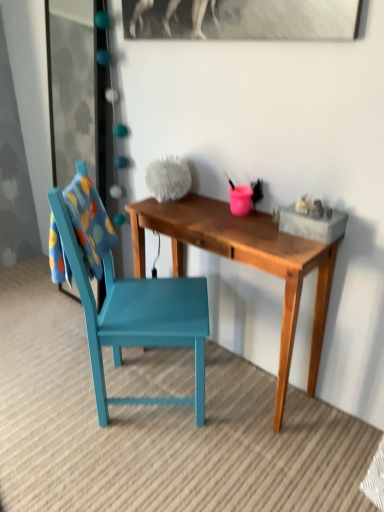
The width and height of the screenshot is (384, 512). What are the coordinates of `wooden desk at center` in the screenshot? It's located at (245, 263).

How far apart are transparent glass door at upper left and teal painted wood chair at left?

transparent glass door at upper left is 1.54 meters away from teal painted wood chair at left.

Based on the photo, can we say transparent glass door at upper left lies outside teal painted wood chair at left?

Yes, transparent glass door at upper left is not within teal painted wood chair at left.

From the image's perspective, between transparent glass door at upper left and teal painted wood chair at left, which one is located above?

transparent glass door at upper left.

Does transparent glass door at upper left have a larger size compared to teal painted wood chair at left?

Actually, transparent glass door at upper left might be smaller than teal painted wood chair at left.

From a real-world perspective, relative to wooden desk at center, is teal painted wood chair at left vertically above or below?

In terms of real-world spatial position, teal painted wood chair at left is above wooden desk at center.

From the image's perspective, does teal painted wood chair at left appear higher than wooden desk at center?

Yes.

Considering the points (104, 405) and (131, 217), which point is behind, point (104, 405) or point (131, 217)?

The point (131, 217) is farther from the camera.

Is teal painted wood chair at left not close to wooden desk at center?

No, there isn't a large distance between teal painted wood chair at left and wooden desk at center.

From a real-world perspective, between transparent glass door at upper left and wooden desk at center, who is vertically lower?

From a 3D spatial view, wooden desk at center is below.

Does transparent glass door at upper left touch wooden desk at center?

No, transparent glass door at upper left is not in contact with wooden desk at center.

Is transparent glass door at upper left situated inside wooden desk at center or outside?

transparent glass door at upper left is not enclosed by wooden desk at center.

Is transparent glass door at upper left positioned behind wooden desk at center?

Yes, transparent glass door at upper left is behind wooden desk at center.

Is point (170, 399) behind point (49, 103)?

That is False.

Looking at this image, from a real-world perspective, is teal painted wood chair at left under transparent glass door at upper left?

Yes, from a real-world perspective, teal painted wood chair at left is beneath transparent glass door at upper left.

Looking at this image, how many degrees apart are the facing directions of teal painted wood chair at left and transparent glass door at upper left?

The angular difference between teal painted wood chair at left and transparent glass door at upper left is 129 degrees.

From the image's perspective, who appears lower, teal painted wood chair at left or transparent glass door at upper left?

teal painted wood chair at left, from the image's perspective.

Looking at their sizes, would you say wooden desk at center is wider or thinner than transparent glass door at upper left?

In the image, wooden desk at center appears to be wider than transparent glass door at upper left.

How much distance is there between wooden desk at center and transparent glass door at upper left?

wooden desk at center and transparent glass door at upper left are 1.57 meters apart from each other.

Could you tell me if wooden desk at center is turned towards transparent glass door at upper left?

No, wooden desk at center does not turn towards transparent glass door at upper left.

Can you tell me how much wooden desk at center and transparent glass door at upper left differ in facing direction?

0.658 degrees separate the facing orientations of wooden desk at center and transparent glass door at upper left.

Looking at this image, is wooden desk at center thinner than teal painted wood chair at left?

Indeed, wooden desk at center has a lesser width compared to teal painted wood chair at left.

Is wooden desk at center next to teal painted wood chair at left and touching it?

No, wooden desk at center is not touching teal painted wood chair at left.

Considering the sizes of objects wooden desk at center and teal painted wood chair at left in the image provided, who is shorter, wooden desk at center or teal painted wood chair at left?

Standing shorter between the two is wooden desk at center.

How many degrees apart are the facing directions of wooden desk at center and teal painted wood chair at left?

wooden desk at center and teal painted wood chair at left are facing 130 degrees away from each other.

What are the coordinates of `chair located underneath the transparent glass door at upper left (from a real-world perspective)` in the screenshot? It's located at (136, 317).

Identify the location of desk lying behind the teal painted wood chair at left. This screenshot has width=384, height=512. (245, 263).

Estimate the real-world distances between objects in this image. Which object is further from teal painted wood chair at left, transparent glass door at upper left or wooden desk at center?

transparent glass door at upper left lies further to teal painted wood chair at left than the other object.

Based on their spatial positions, is transparent glass door at upper left or teal painted wood chair at left closer to wooden desk at center?

teal painted wood chair at left.

Based on the photo, considering their positions, is teal painted wood chair at left positioned further to wooden desk at center than transparent glass door at upper left?

Among the two, transparent glass door at upper left is located further to wooden desk at center.

Looking at this image, which object lies further to the anchor point transparent glass door at upper left, wooden desk at center or teal painted wood chair at left?

wooden desk at center.

Looking at this image, based on their spatial positions, is teal painted wood chair at left or wooden desk at center further from transparent glass door at upper left?

Among the two, wooden desk at center is located further to transparent glass door at upper left.

Which object lies further to the anchor point teal painted wood chair at left, wooden desk at center or transparent glass door at upper left?

The object further to teal painted wood chair at left is transparent glass door at upper left.

At what (x,y) coordinates should I click in order to perform the action: click on chair between transparent glass door at upper left and wooden desk at center in the vertical direction. Please return your answer as a coordinate pair (x, y). Looking at the image, I should click on (136, 317).